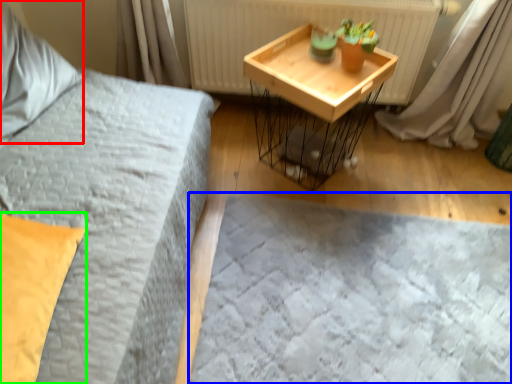
Question: Which object is the farthest from pillow (highlighted by a red box)? Choose among these: bed frame (highlighted by a blue box) or pillow (highlighted by a green box).

Choices:
 (A) bed frame
 (B) pillow

Answer: (A)